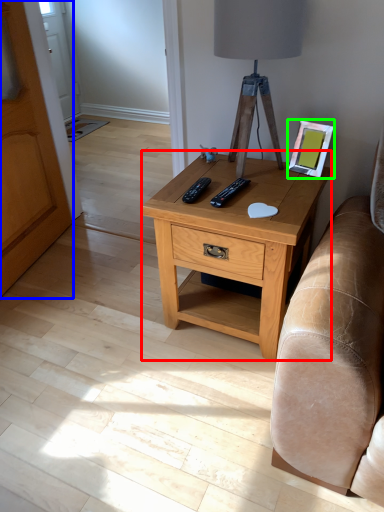
Question: Estimate the real-world distances between objects in this image. Which object is closer to nightstand (highlighted by a red box), armoire (highlighted by a blue box) or picture frame (highlighted by a green box)?

Choices:
 (A) armoire
 (B) picture frame

Answer: (B)